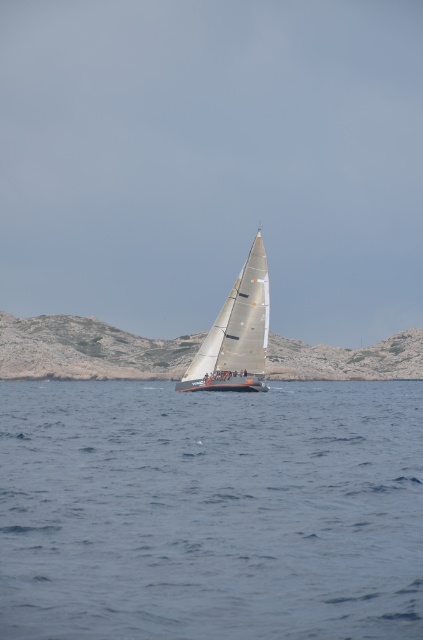
Question: Is blue water at center wider than white matte sailboat at center?

Choices:
 (A) no
 (B) yes

Answer: (B)

Question: Does blue water at center appear on the left side of white matte sailboat at center?

Choices:
 (A) yes
 (B) no

Answer: (A)

Question: Can you confirm if blue water at center is thinner than white matte sailboat at center?

Choices:
 (A) yes
 (B) no

Answer: (B)

Question: Which point is farther to the camera?

Choices:
 (A) white matte sailboat at center
 (B) blue water at center

Answer: (A)

Question: Which point is farther to the camera?

Choices:
 (A) (16, 557)
 (B) (247, 268)

Answer: (B)